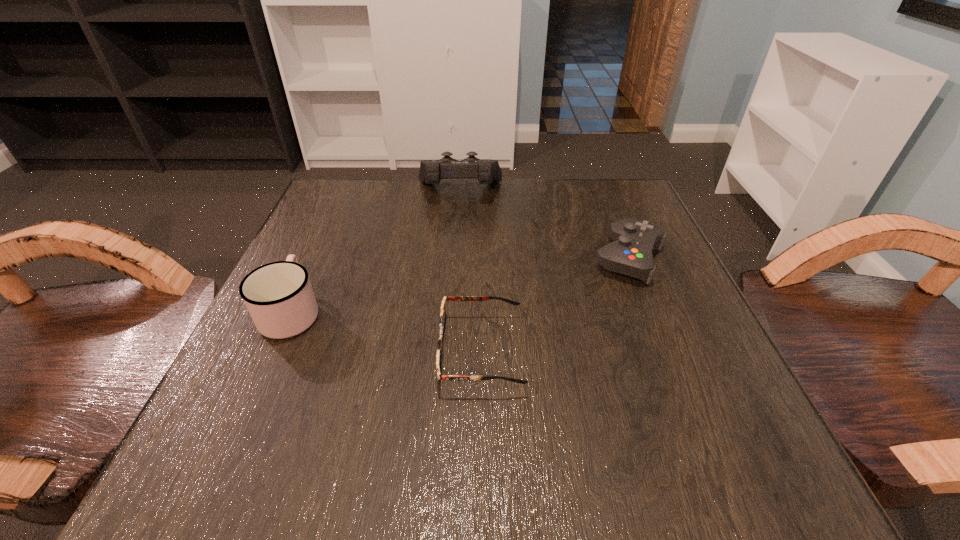
The image size is (960, 540). I want to click on free space that is in between the right control and the left control, so click(544, 225).

Where is `unoccupied position between the farther control and the mug`? Image resolution: width=960 pixels, height=540 pixels. unoccupied position between the farther control and the mug is located at coordinates (375, 251).

The image size is (960, 540). Identify the location of blank region between the shorter control and the leftmost object. (461, 285).

Locate an element on the screen. The height and width of the screenshot is (540, 960). empty location between the taller control and the spectacles is located at coordinates (470, 272).

Where is `blank region between the farthest object and the third tallest object`? The image size is (960, 540). blank region between the farthest object and the third tallest object is located at coordinates (544, 225).

Locate which object ranks third in proximity to the shortest object. Please provide its 2D coordinates. Your answer should be formatted as a tuple, i.e. [(x, y)], where the tuple contains the x and y coordinates of a point satisfying the conditions above.

[(487, 171)]

Identify which object is located as the nearest to the leftmost object. Please provide its 2D coordinates. Your answer should be formatted as a tuple, i.e. [(x, y)], where the tuple contains the x and y coordinates of a point satisfying the conditions above.

[(442, 322)]

Identify the location of vacant space that satisfies the following two spatial constraints: 1. on the side of the taller control with the handle; 2. on the left side of the mug. (346, 191).

Locate an element on the screen. The width and height of the screenshot is (960, 540). vacant point that satisfies the following two spatial constraints: 1. on the side of the leftmost object with the handle; 2. on the left side of the rightmost object is located at coordinates (315, 259).

Image resolution: width=960 pixels, height=540 pixels. What are the coordinates of `free location that satisfies the following two spatial constraints: 1. on the side of the third tallest object with the handle; 2. on the right side of the leftmost object` in the screenshot? It's located at 315,259.